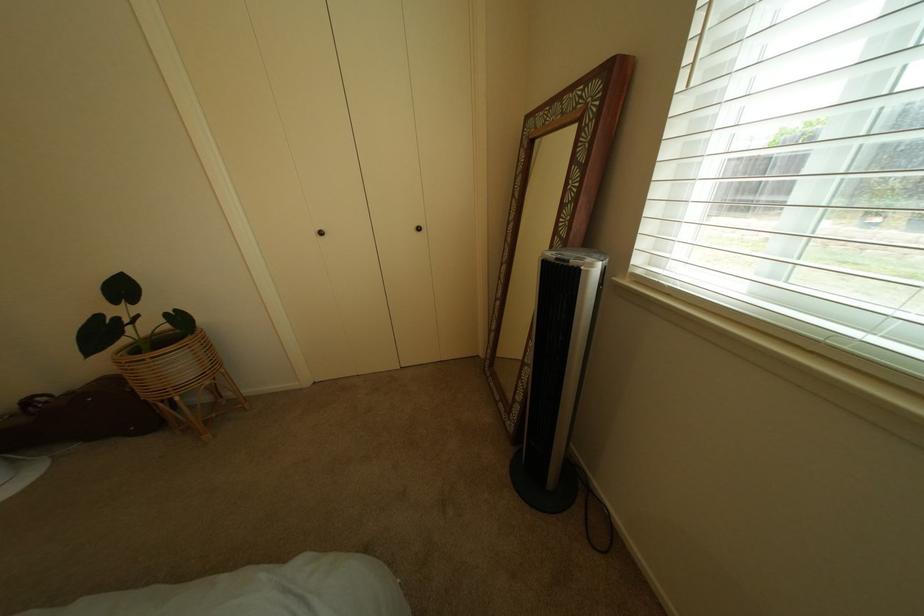
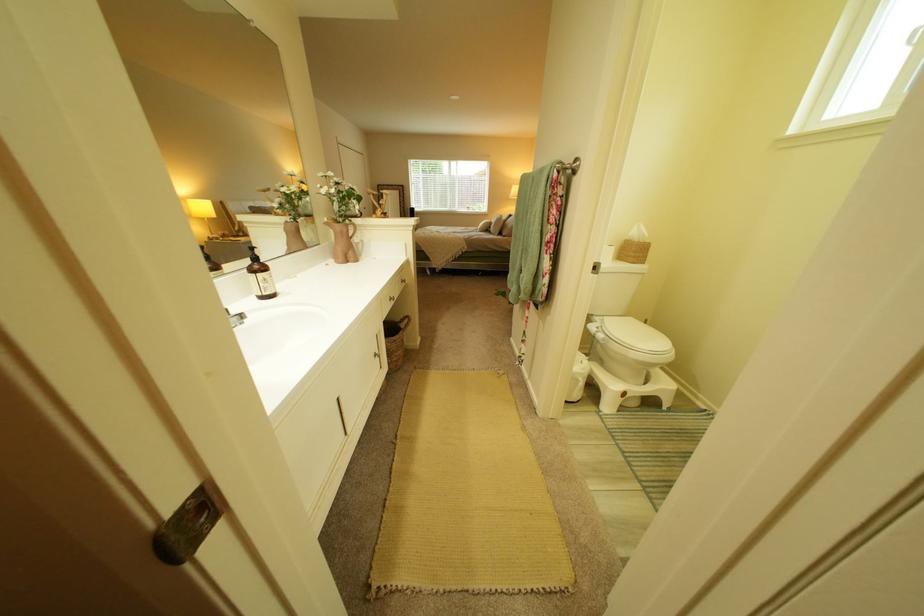
Question: I am providing you with two images of the same scene from different viewpoints. After the viewpoint changes to image2, which objects are now occluded?

Choices:
 (A) grey pillow
 (B) white chalkboard eraser
 (C) pink pitcher handle
 (D) white blind cord

Answer: (D)